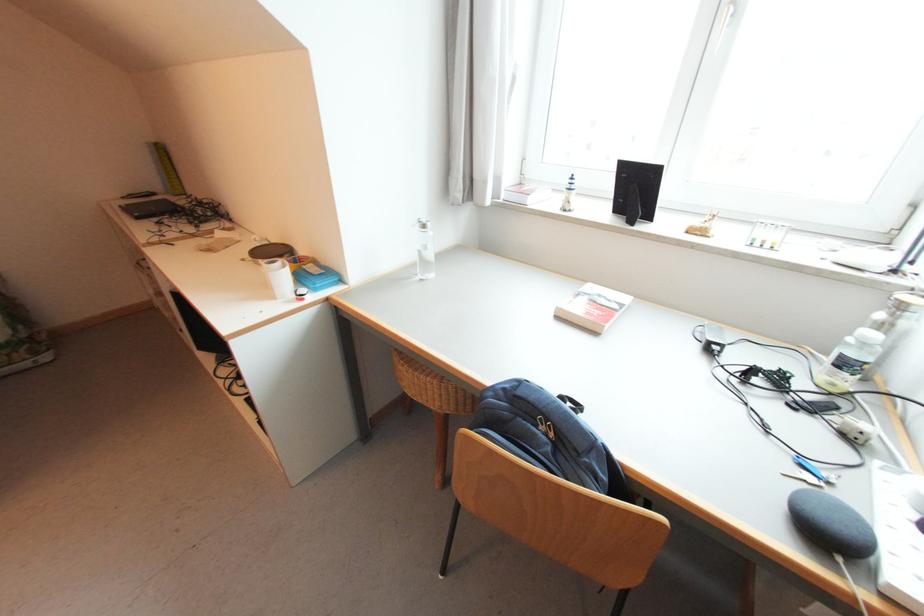
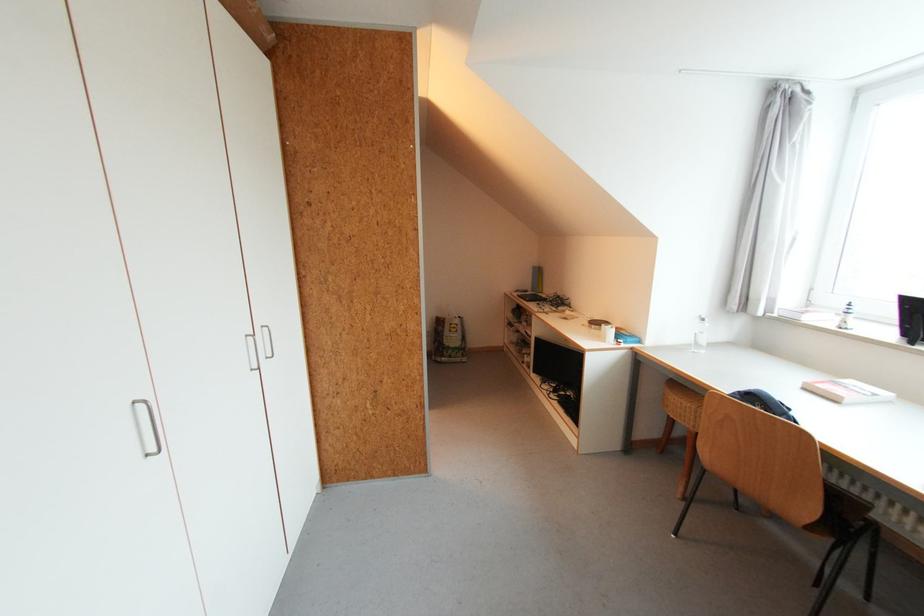
Find the pixel in the second image that matches the point at 600,333 in the first image.

(841, 403)